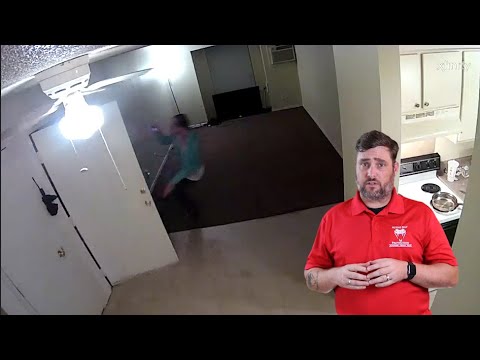
You are a GUI agent. You are given a task and a screenshot of the screen. Output one action in this format:
    pyautogui.click(x=<x>, y=<y>)
    Task: Click on the knobs for cooking
    This screenshot has width=480, height=360.
    Given the screenshot: What is the action you would take?
    pyautogui.click(x=424, y=164)